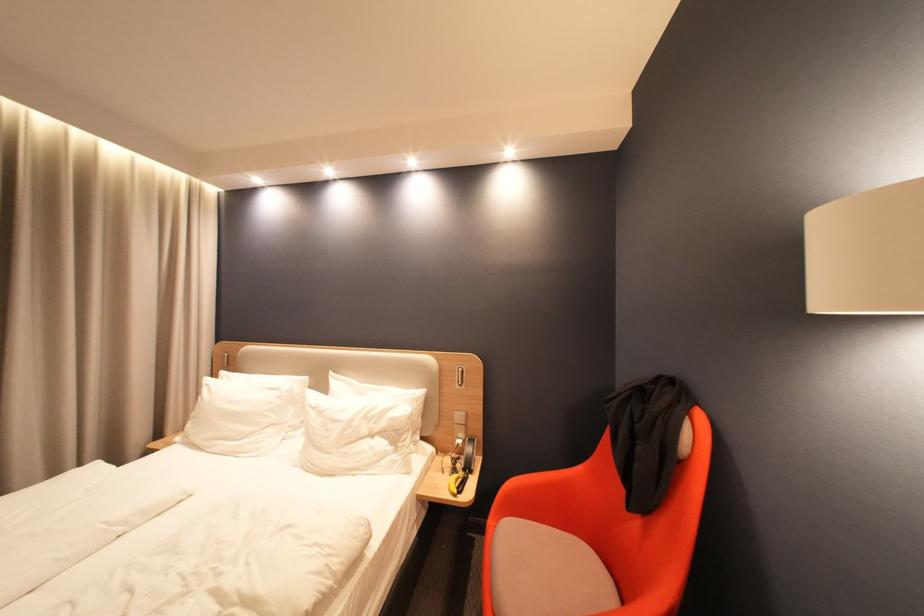
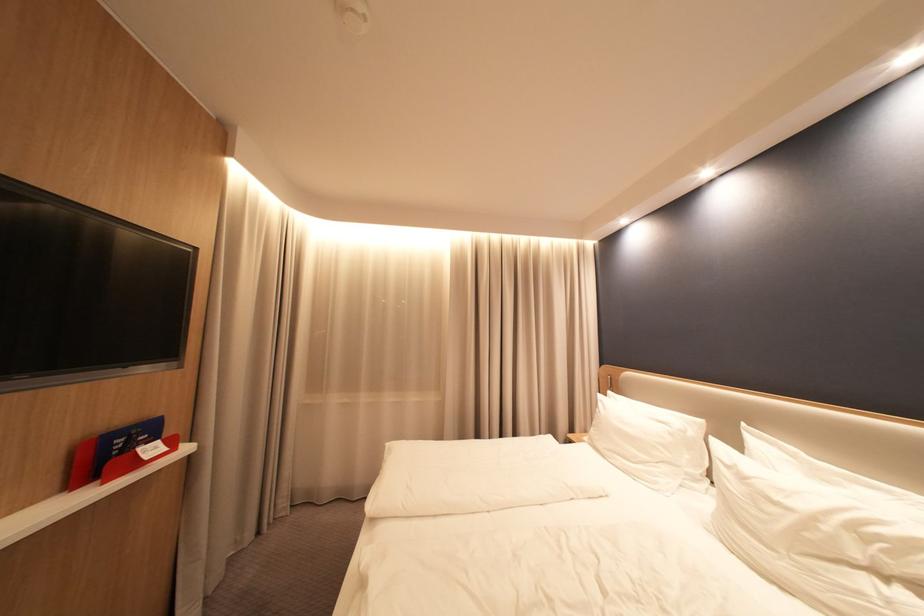
Question: Based on the continuous images, in which direction is the camera rotating? Reply with the corresponding letter.

Choices:
 (A) Left
 (B) Right
 (C) Up
 (D) Down

Answer: (A)